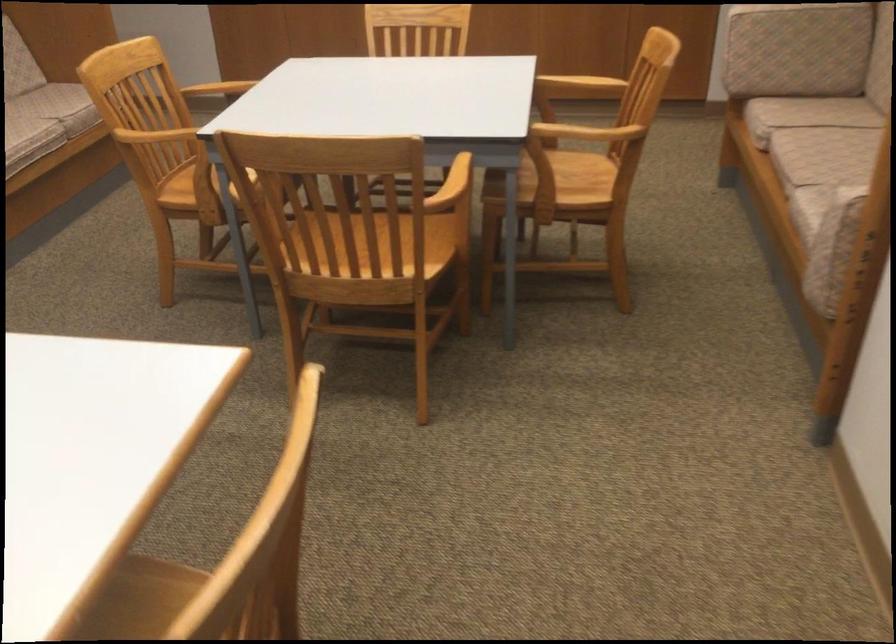
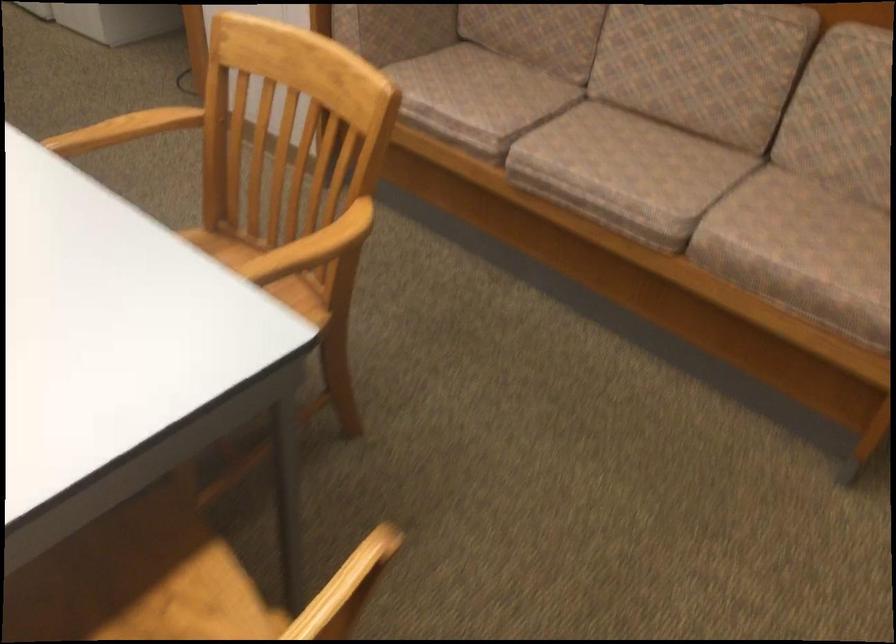
Find the pixel in the second image that matches point (138, 138) in the first image.

(151, 122)